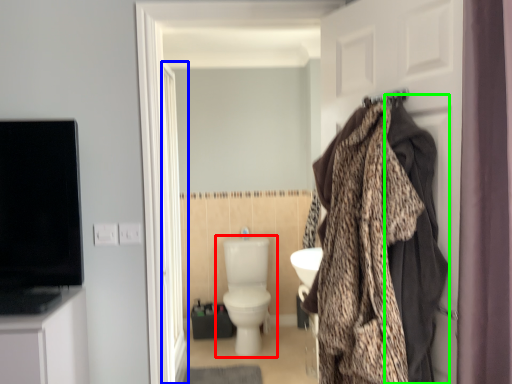
Question: Which object is positioned closest to toilet (highlighted by a red box)? Select from screen door (highlighted by a blue box) and blanket (highlighted by a green box).

Choices:
 (A) screen door
 (B) blanket

Answer: (A)